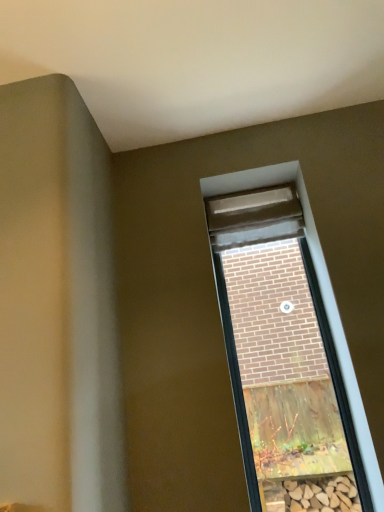
Where is `clear glass window at upper center`? Image resolution: width=384 pixels, height=512 pixels. clear glass window at upper center is located at coordinates (321, 294).

This screenshot has width=384, height=512. Describe the element at coordinates (321, 294) in the screenshot. I see `clear glass window at upper center` at that location.

Consider the image. What is the approximate width of clear glass window at upper center?

clear glass window at upper center is 1.64 inches in width.

Where is `clear glass window at upper center`? This screenshot has width=384, height=512. clear glass window at upper center is located at coordinates (321, 294).